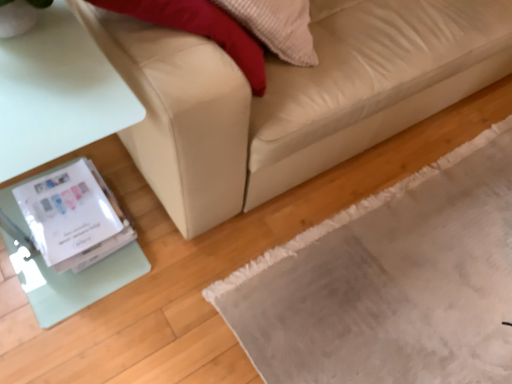
Question: Is beige leather couch at lower left smaller than white glossy wii at lower left?

Choices:
 (A) no
 (B) yes

Answer: (A)

Question: Considering the relative sizes of beige leather couch at lower left and white glossy wii at lower left in the image provided, is beige leather couch at lower left taller than white glossy wii at lower left?

Choices:
 (A) no
 (B) yes

Answer: (B)

Question: Considering the relative positions of beige leather couch at lower left and white glossy wii at lower left in the image provided, is beige leather couch at lower left to the left of white glossy wii at lower left from the viewer's perspective?

Choices:
 (A) no
 (B) yes

Answer: (A)

Question: Is beige leather couch at lower left further to the viewer compared to white glossy wii at lower left?

Choices:
 (A) no
 (B) yes

Answer: (A)

Question: Is beige leather couch at lower left beside white glossy wii at lower left?

Choices:
 (A) no
 (B) yes

Answer: (A)

Question: Is point (90, 243) positioned closer to the camera than point (396, 132)?

Choices:
 (A) farther
 (B) closer

Answer: (B)

Question: In terms of width, does white glossy wii at lower left look wider or thinner when compared to beige leather couch at lower left?

Choices:
 (A) wide
 (B) thin

Answer: (B)

Question: Is white glossy wii at lower left situated inside beige leather couch at lower left or outside?

Choices:
 (A) inside
 (B) outside

Answer: (B)

Question: Considering the relative positions of white glossy wii at lower left and beige leather couch at lower left in the image provided, is white glossy wii at lower left to the left or to the right of beige leather couch at lower left?

Choices:
 (A) left
 (B) right

Answer: (A)

Question: Considering the positions of beige leather couch at lower left and gray textured mat at lower right in the image, is beige leather couch at lower left bigger or smaller than gray textured mat at lower right?

Choices:
 (A) small
 (B) big

Answer: (B)

Question: From the image's perspective, is beige leather couch at lower left above or below gray textured mat at lower right?

Choices:
 (A) below
 (B) above

Answer: (B)

Question: Considering their positions, is beige leather couch at lower left located in front of or behind gray textured mat at lower right?

Choices:
 (A) behind
 (B) front

Answer: (B)

Question: Considering the positions of beige leather couch at lower left and gray textured mat at lower right in the image, is beige leather couch at lower left taller or shorter than gray textured mat at lower right?

Choices:
 (A) tall
 (B) short

Answer: (A)

Question: From the image's perspective, is white glossy wii at lower left positioned above or below gray textured mat at lower right?

Choices:
 (A) below
 (B) above

Answer: (B)

Question: Is point (69, 256) positioned closer to the camera than point (432, 226)?

Choices:
 (A) closer
 (B) farther

Answer: (A)